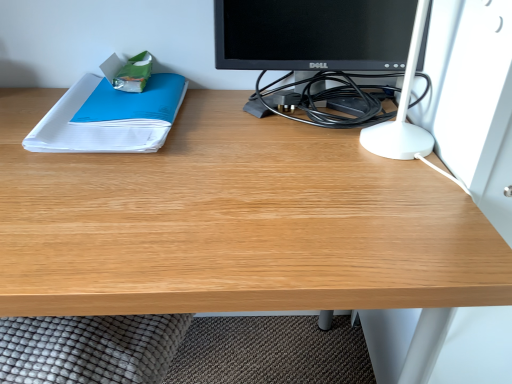
Image resolution: width=512 pixels, height=384 pixels. In order to click on free point in front of black glossy monitor at upper center in this screenshot , I will do `click(308, 205)`.